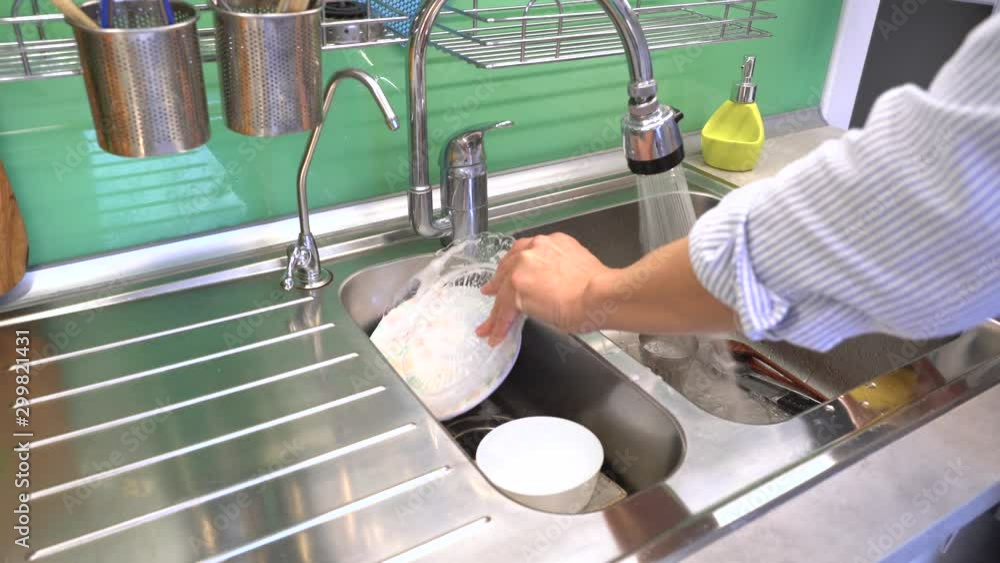
This screenshot has width=1000, height=563. What are the coordinates of `soap` in the screenshot? It's located at (740, 113).